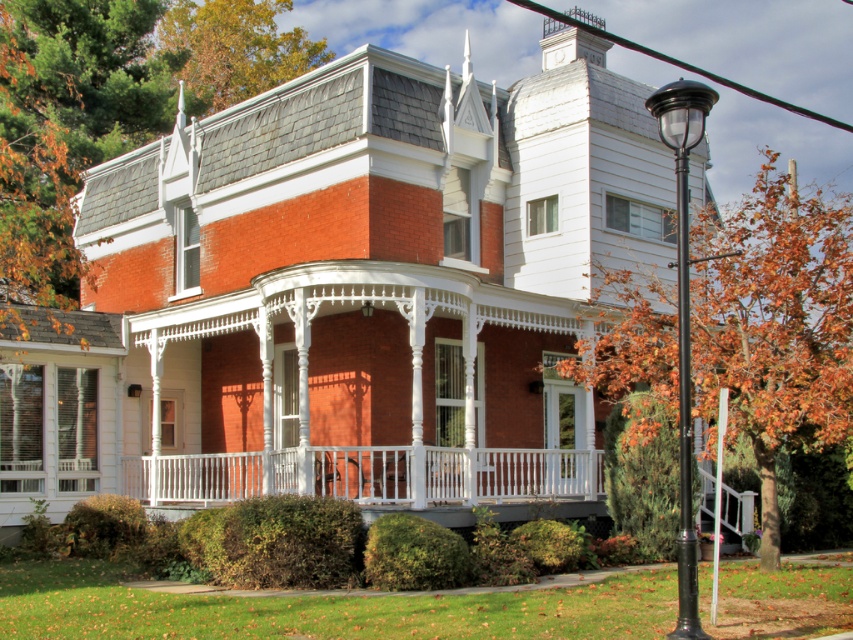
Is point (537, 484) in front of point (680, 316)?

No, (537, 484) is behind (680, 316).

Which of these two, white painted wood porch at center or black polished metal lamp post at right, stands taller?

Standing taller between the two is black polished metal lamp post at right.

Where is `white painted wood porch at center`? white painted wood porch at center is located at coordinates (368, 474).